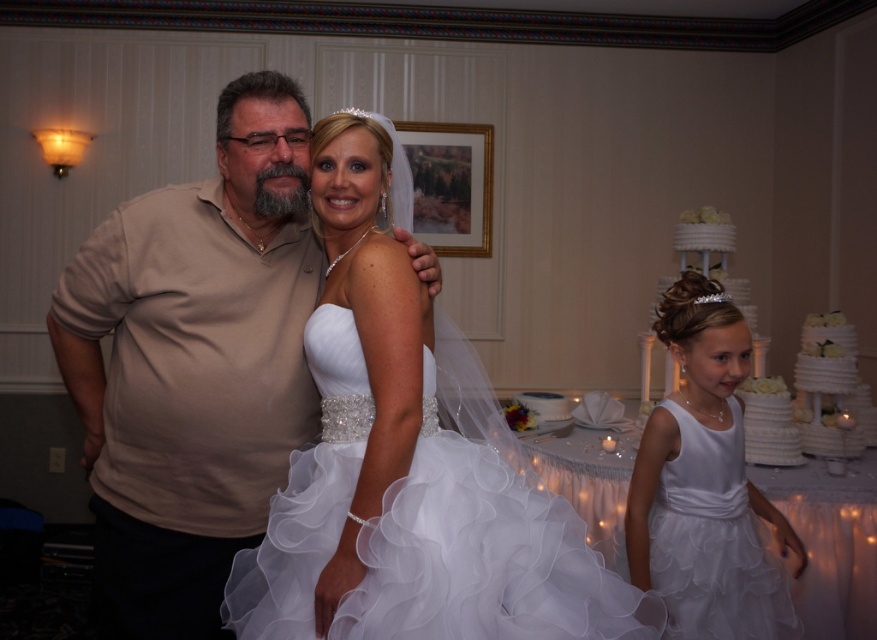
Question: Is white satin dress at right positioned in front of white textured cake at right?

Choices:
 (A) yes
 (B) no

Answer: (A)

Question: Based on their relative distances, which object is farther from the white satin dress at right?

Choices:
 (A) white satin dress at center
 (B) white textured cake at right
 (C) beige cotton shirt at center

Answer: (C)

Question: Is white satin dress at center to the left of white textured cake at right from the viewer's perspective?

Choices:
 (A) no
 (B) yes

Answer: (B)

Question: Is white satin dress at center wider than beige cotton shirt at center?

Choices:
 (A) yes
 (B) no

Answer: (A)

Question: Which object is farther from the camera taking this photo?

Choices:
 (A) beige cotton shirt at center
 (B) white textured cake at right
 (C) white satin dress at right

Answer: (B)

Question: Which object is the farthest from the white satin dress at center?

Choices:
 (A) white textured cake at right
 (B) white satin dress at right

Answer: (A)